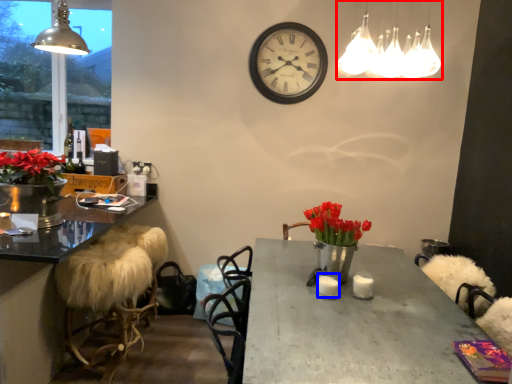
Question: Which object appears farthest to the camera in this image, lamp (highlighted by a red box) or candle (highlighted by a blue box)?

Choices:
 (A) lamp
 (B) candle

Answer: (B)